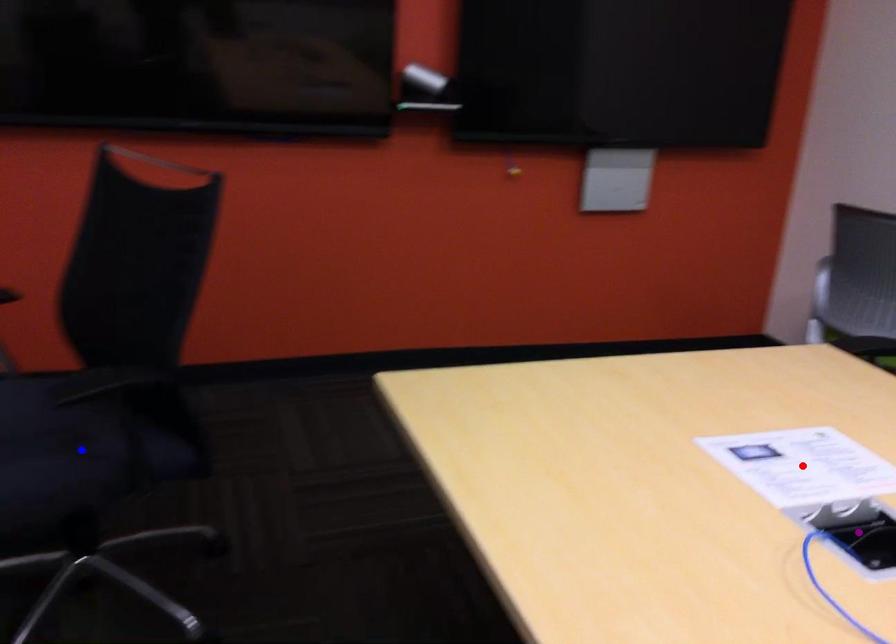
Order these from nearest to farthest:
- red point
- purple point
- blue point

purple point < red point < blue point